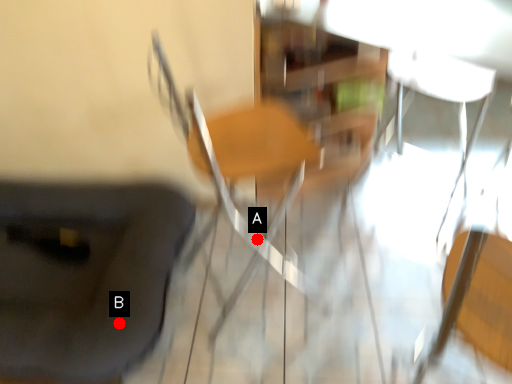
Question: Two points are circled on the image, labeled by A and B beside each circle. Which point appears closest to the camera in this image?

Choices:
 (A) A is closer
 (B) B is closer

Answer: (B)